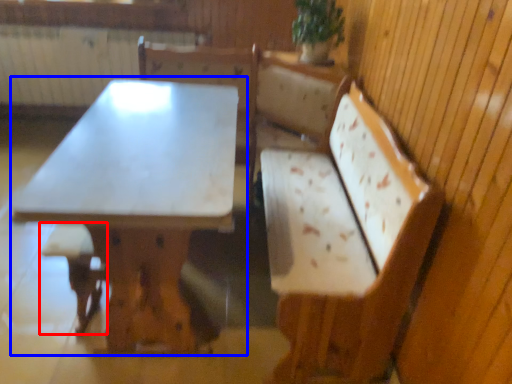
Question: Which of the following is the closest to the observer, step stool (highlighted by a red box) or table (highlighted by a blue box)?

Choices:
 (A) step stool
 (B) table

Answer: (B)